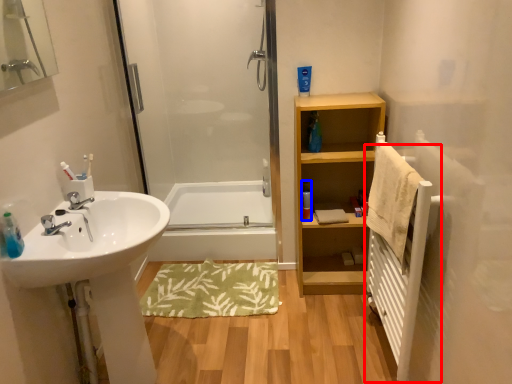
Question: Which object appears farthest to the camera in this image, radiator (highlighted by a red box) or toiletry (highlighted by a blue box)?

Choices:
 (A) radiator
 (B) toiletry

Answer: (B)